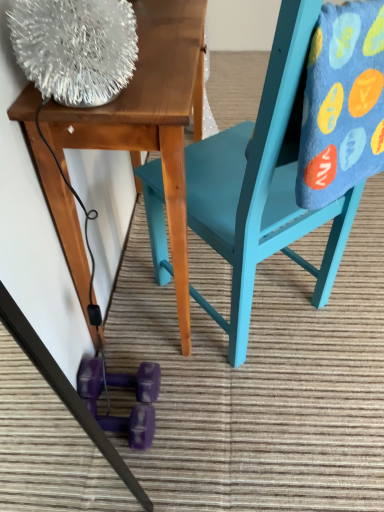
What is the approximate width of purple rubber dumbbell at lower center?

8.20 inches.

The width and height of the screenshot is (384, 512). Describe the element at coordinates (262, 186) in the screenshot. I see `teal painted wood chair at center` at that location.

Measure the distance between blue fuzzy blanket at upper right and camera.

blue fuzzy blanket at upper right and camera are 52.13 centimeters apart from each other.

Locate an element on the screen. purple rubber dumbbell at lower center is located at coordinates (123, 387).

Is purple rubber dumbbell at lower center completely or partially inside wooden table at upper left?

Definitely not — purple rubber dumbbell at lower center is not inside wooden table at upper left.

Measure the distance between wooden table at upper left and purple rubber dumbbell at lower center.

The distance of wooden table at upper left from purple rubber dumbbell at lower center is 15.60 inches.

Considering the sizes of objects wooden table at upper left and purple rubber dumbbell at lower center in the image provided, who is taller, wooden table at upper left or purple rubber dumbbell at lower center?

With more height is wooden table at upper left.

Which of these two, wooden table at upper left or purple rubber dumbbell at lower center, is thinner?

purple rubber dumbbell at lower center is thinner.

From the image's perspective, is blue fuzzy blanket at upper right positioned above or below purple rubber dumbbell at lower center?

From the image's perspective, blue fuzzy blanket at upper right appears above purple rubber dumbbell at lower center.

Is blue fuzzy blanket at upper right positioned with its back to purple rubber dumbbell at lower center?

blue fuzzy blanket at upper right does not have its back to purple rubber dumbbell at lower center.

Considering the relative sizes of blue fuzzy blanket at upper right and purple rubber dumbbell at lower center in the image provided, is blue fuzzy blanket at upper right smaller than purple rubber dumbbell at lower center?

Incorrect, blue fuzzy blanket at upper right is not smaller in size than purple rubber dumbbell at lower center.

Is blue fuzzy blanket at upper right surrounding purple rubber dumbbell at lower center?

Definitely not — purple rubber dumbbell at lower center is not inside blue fuzzy blanket at upper right.

Which of these two, blue fuzzy blanket at upper right or teal painted wood chair at center, is thinner?

With smaller width is blue fuzzy blanket at upper right.

How many degrees apart are the facing directions of blue fuzzy blanket at upper right and teal painted wood chair at center?

They differ by 0.00038 degrees in their facing directions.

Is blue fuzzy blanket at upper right taller or shorter than teal painted wood chair at center?

Clearly, blue fuzzy blanket at upper right is shorter compared to teal painted wood chair at center.

Based on the photo, can you confirm if blue fuzzy blanket at upper right is smaller than teal painted wood chair at center?

Yes, blue fuzzy blanket at upper right is smaller than teal painted wood chair at center.

Considering the sizes of objects blue fuzzy blanket at upper right and wooden table at upper left in the image provided, who is bigger, blue fuzzy blanket at upper right or wooden table at upper left?

wooden table at upper left.

Is blue fuzzy blanket at upper right next to wooden table at upper left?

No, blue fuzzy blanket at upper right is not with wooden table at upper left.

From the image's perspective, which object appears higher, blue fuzzy blanket at upper right or wooden table at upper left?

blue fuzzy blanket at upper right appears higher in the image.

Would you consider wooden table at upper left to be distant from teal painted wood chair at center?

No, wooden table at upper left is not far away from teal painted wood chair at center.

From the image's perspective, which one is positioned higher, wooden table at upper left or teal painted wood chair at center?

wooden table at upper left, from the image's perspective.

Could you tell me if wooden table at upper left is facing teal painted wood chair at center?

Yes, wooden table at upper left is facing teal painted wood chair at center.

Is wooden table at upper left at the left side of blue fuzzy blanket at upper right?

Indeed, wooden table at upper left is positioned on the left side of blue fuzzy blanket at upper right.

Considering the relative sizes of wooden table at upper left and blue fuzzy blanket at upper right in the image provided, is wooden table at upper left shorter than blue fuzzy blanket at upper right?

No, wooden table at upper left is not shorter than blue fuzzy blanket at upper right.

How different are the orientations of wooden table at upper left and blue fuzzy blanket at upper right in degrees?

wooden table at upper left and blue fuzzy blanket at upper right are facing 130 degrees away from each other.

From the image's perspective, which is below, wooden table at upper left or blue fuzzy blanket at upper right?

From the image's view, wooden table at upper left is below.

From a real-world perspective, who is located higher, teal painted wood chair at center or blue fuzzy blanket at upper right?

From a 3D spatial view, blue fuzzy blanket at upper right is above.

Considering the positions of point (211, 195) and point (375, 128), is point (211, 195) closer or farther from the camera than point (375, 128)?

Point (211, 195) is farther from the camera than point (375, 128).

Where is `table lying in front of the purple rubber dumbbell at lower center`? table lying in front of the purple rubber dumbbell at lower center is located at coordinates (151, 117).

Locate an element on the screen. This screenshot has width=384, height=512. toy below the blue fuzzy blanket at upper right (from the image's perspective) is located at coordinates (123, 387).

Looking at this image, which object lies nearer to the anchor point purple rubber dumbbell at lower center, wooden table at upper left or blue fuzzy blanket at upper right?

Based on the image, wooden table at upper left appears to be nearer to purple rubber dumbbell at lower center.

From the image, which object appears to be farther from teal painted wood chair at center, wooden table at upper left or purple rubber dumbbell at lower center?

Based on the image, purple rubber dumbbell at lower center appears to be further to teal painted wood chair at center.

Looking at the image, which one is located further to blue fuzzy blanket at upper right, purple rubber dumbbell at lower center or wooden table at upper left?

The object further to blue fuzzy blanket at upper right is purple rubber dumbbell at lower center.

From the image, which object appears to be nearer to teal painted wood chair at center, purple rubber dumbbell at lower center or wooden table at upper left?

wooden table at upper left.

Estimate the real-world distances between objects in this image. Which object is further from purple rubber dumbbell at lower center, blue fuzzy blanket at upper right or teal painted wood chair at center?

blue fuzzy blanket at upper right is positioned further to the anchor purple rubber dumbbell at lower center.

Which object lies further to the anchor point teal painted wood chair at center, blue fuzzy blanket at upper right or purple rubber dumbbell at lower center?

purple rubber dumbbell at lower center is positioned further to the anchor teal painted wood chair at center.

Based on their spatial positions, is teal painted wood chair at center or blue fuzzy blanket at upper right further from purple rubber dumbbell at lower center?

blue fuzzy blanket at upper right.

Considering their positions, is wooden table at upper left positioned further to blue fuzzy blanket at upper right than teal painted wood chair at center?

Among the two, wooden table at upper left is located further to blue fuzzy blanket at upper right.

Image resolution: width=384 pixels, height=512 pixels. I want to click on table between blue fuzzy blanket at upper right and purple rubber dumbbell at lower center vertically, so click(151, 117).

Locate an element on the screen. chair between blue fuzzy blanket at upper right and purple rubber dumbbell at lower center from top to bottom is located at coordinates (262, 186).

Image resolution: width=384 pixels, height=512 pixels. Find the location of `chair between wooden table at upper left and blue fuzzy blanket at upper right in the horizontal direction`. chair between wooden table at upper left and blue fuzzy blanket at upper right in the horizontal direction is located at coordinates (262, 186).

Where is `chair between wooden table at upper left and purple rubber dumbbell at lower center in the up-down direction`? This screenshot has width=384, height=512. chair between wooden table at upper left and purple rubber dumbbell at lower center in the up-down direction is located at coordinates (262, 186).